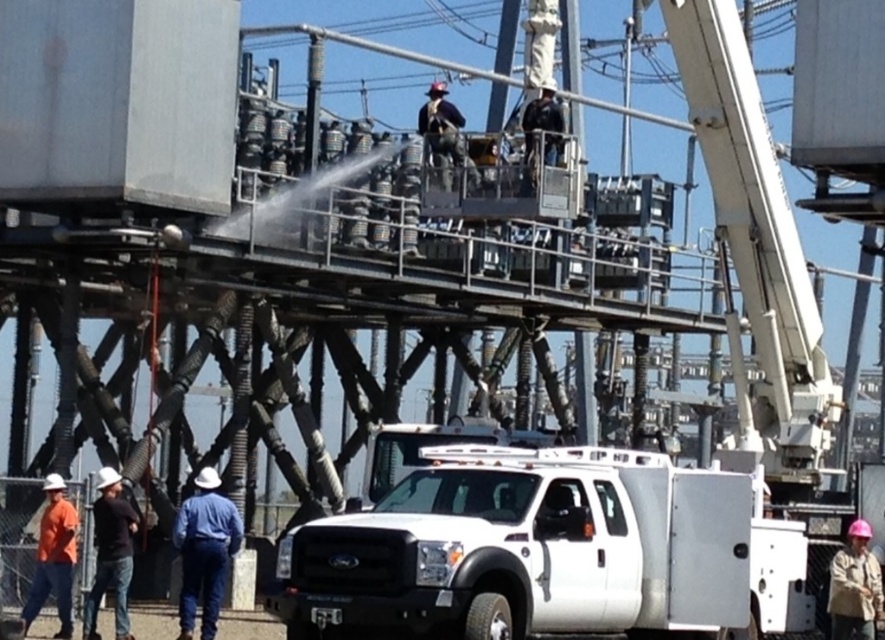
Can you confirm if white metallic utility truck at center is bigger than pink hard hat at lower right?

Yes, white metallic utility truck at center is bigger than pink hard hat at lower right.

Does white metallic utility truck at center have a lesser width compared to pink hard hat at lower right?

Incorrect, white metallic utility truck at center's width is not less than pink hard hat at lower right's.

The image size is (885, 640). Find the location of `white metallic utility truck at center`. white metallic utility truck at center is located at coordinates (548, 550).

Which is below, white metallic utility truck at center or blue denim jeans at lower left?

blue denim jeans at lower left is below.

Does white metallic utility truck at center have a smaller size compared to blue denim jeans at lower left?

Actually, white metallic utility truck at center might be larger than blue denim jeans at lower left.

Identify the location of white metallic utility truck at center. The width and height of the screenshot is (885, 640). (548, 550).

In order to click on white metallic utility truck at center in this screenshot , I will do `click(548, 550)`.

Is orange hard hat at lower left smaller than pink hard hat at lower right?

Incorrect, orange hard hat at lower left is not smaller in size than pink hard hat at lower right.

Who is more forward, (45, 486) or (864, 525)?

Point (864, 525)

Find the location of `orange hard hat at lower left`. orange hard hat at lower left is located at coordinates (52, 557).